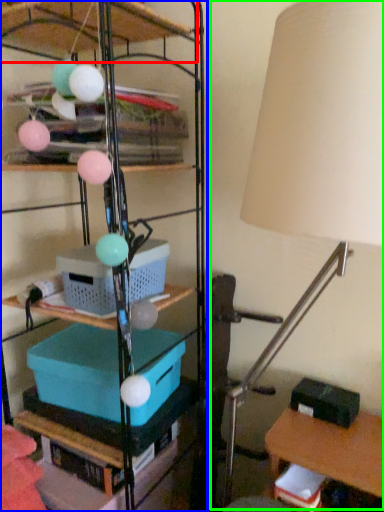
Question: Which object is the closest to the shelf (highlighted by a red box)? Choose among these: shelf (highlighted by a blue box) or lamp (highlighted by a green box).

Choices:
 (A) shelf
 (B) lamp

Answer: (A)